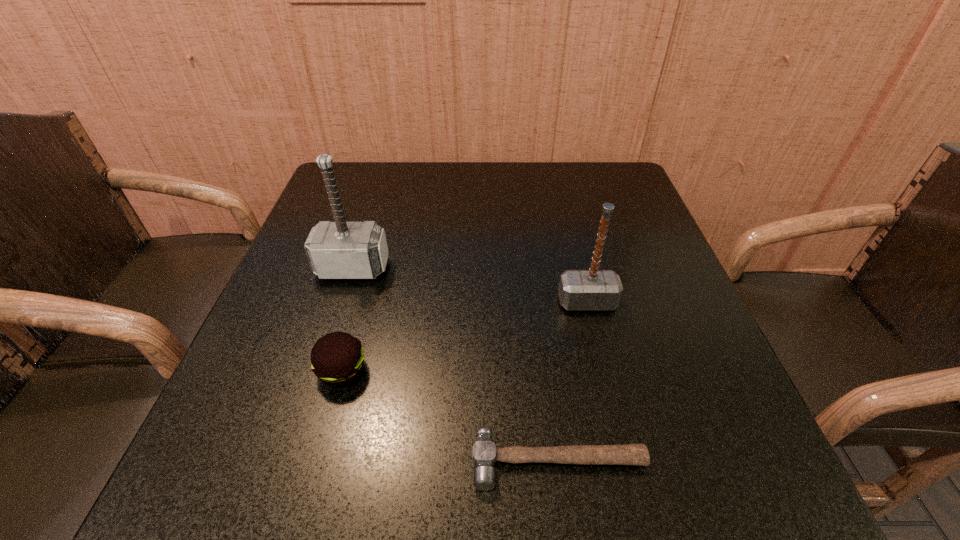
The height and width of the screenshot is (540, 960). Find the location of `vacant space situated 0.140m on the front of the patty`. vacant space situated 0.140m on the front of the patty is located at coordinates (312, 481).

At what (x,y) coordinates should I click in order to perform the action: click on object that is at the near edge. Please return your answer as a coordinate pair (x, y). Looking at the image, I should click on (484, 453).

In order to click on hammer that is at the left edge in this screenshot , I will do `click(336, 250)`.

Find the location of a particular element. The width and height of the screenshot is (960, 540). patty present at the left edge is located at coordinates (337, 358).

Locate an element on the screen. The image size is (960, 540). object that is at the right edge is located at coordinates (593, 289).

This screenshot has height=540, width=960. Identify the location of free region at the far edge of the desktop. (563, 180).

In the image, there is a desktop. Where is `vacant area at the near edge`? This screenshot has width=960, height=540. vacant area at the near edge is located at coordinates (513, 497).

In order to click on free region at the left edge in this screenshot , I will do `click(281, 395)`.

Where is `free space at the right edge of the desktop`? The width and height of the screenshot is (960, 540). free space at the right edge of the desktop is located at coordinates (647, 271).

The image size is (960, 540). I want to click on free space at the near left corner, so click(x=289, y=480).